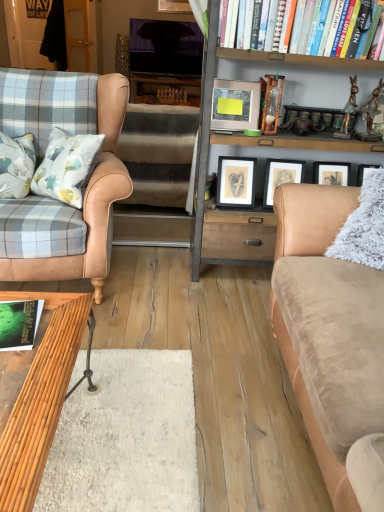
Find the location of a particular element. vacant area on top of green matte book at lower left, positioned as the first book in front-to-back order (from a real-world perspective) is located at coordinates (18, 316).